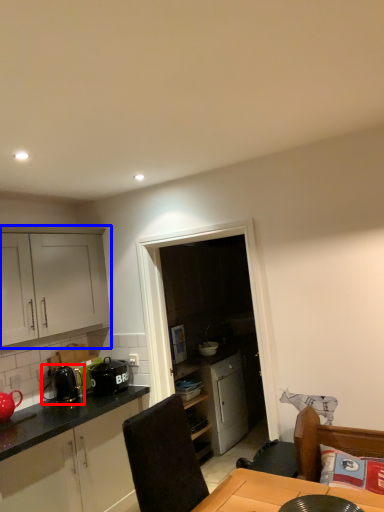
Question: Which point is closer to the camera, appliance (highlighted by a red box) or cabinetry (highlighted by a blue box)?

Choices:
 (A) appliance
 (B) cabinetry

Answer: (B)